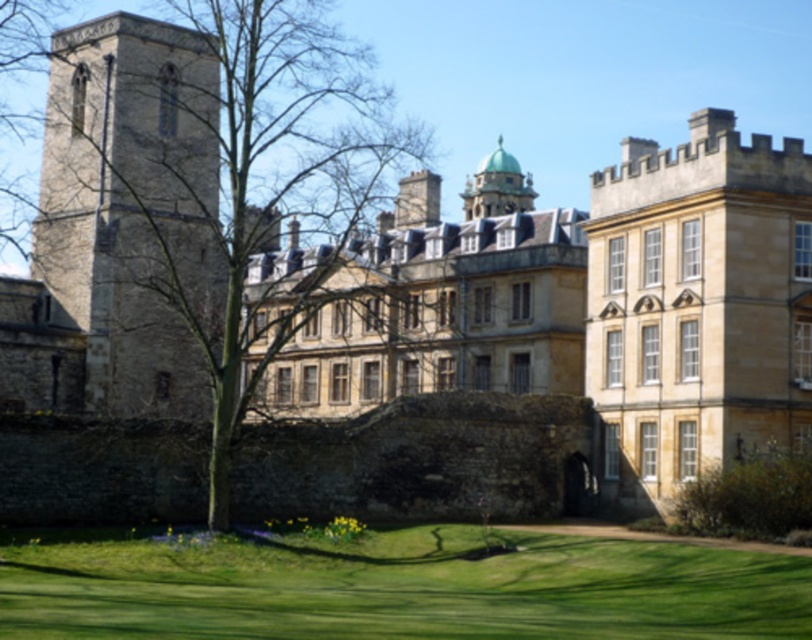
Question: Which object is farther from the camera taking this photo?

Choices:
 (A) green grass at lower center
 (B) stone tower at left

Answer: (B)

Question: Which point is farther to the camera?

Choices:
 (A) stone tower at left
 (B) green grass at lower center

Answer: (A)

Question: Which point is closer to the camera?

Choices:
 (A) (108, 348)
 (B) (242, 605)

Answer: (B)

Question: Is green grass at lower center below stone tower at left?

Choices:
 (A) no
 (B) yes

Answer: (B)

Question: Considering the relative positions of green grass at lower center and stone tower at left in the image provided, where is green grass at lower center located with respect to stone tower at left?

Choices:
 (A) left
 (B) right

Answer: (B)

Question: Is green grass at lower center wider than stone tower at left?

Choices:
 (A) yes
 (B) no

Answer: (A)